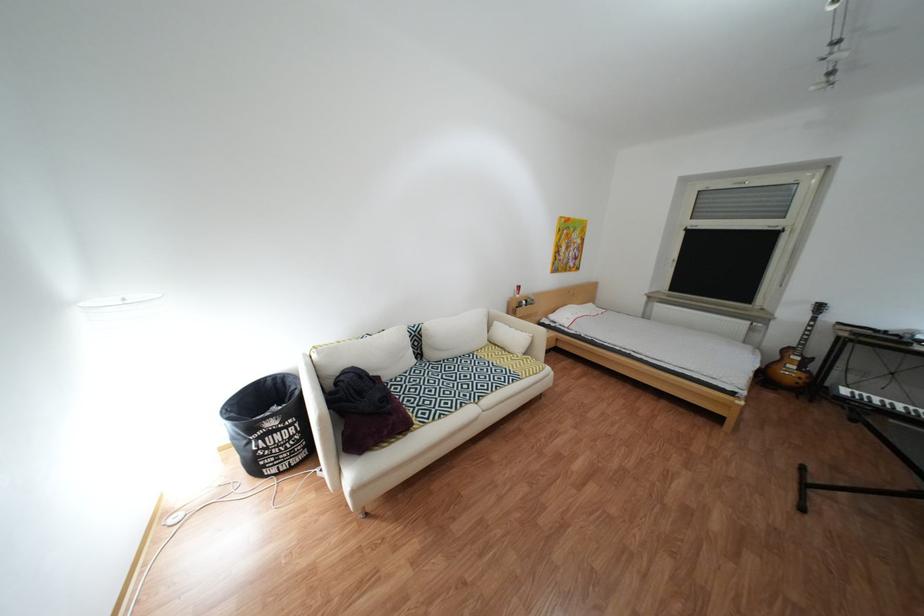
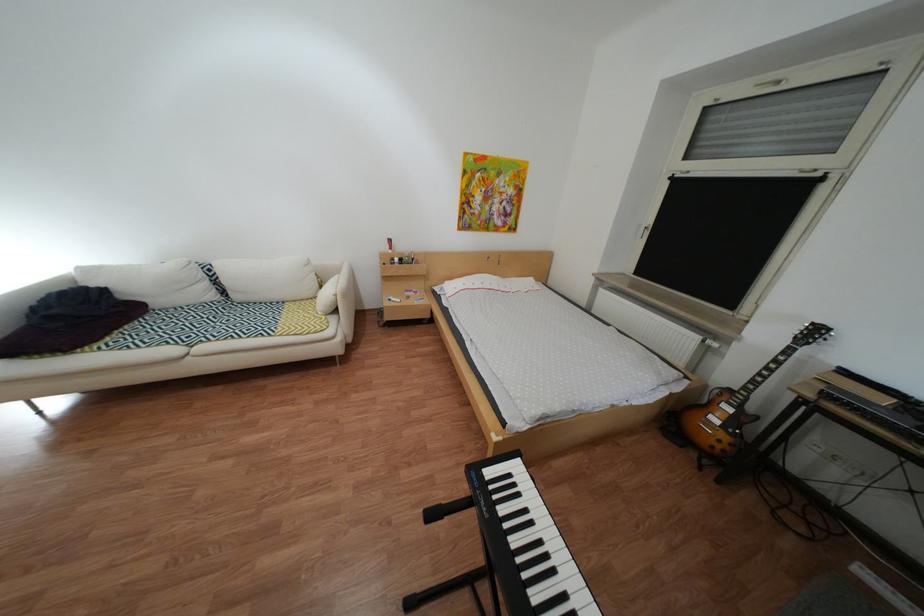
Question: Which direction would the cameraman need to move to produce the second image? Reply with the corresponding letter.

Choices:
 (A) Left
 (B) Right
 (C) Forward
 (D) Backward

Answer: (B)